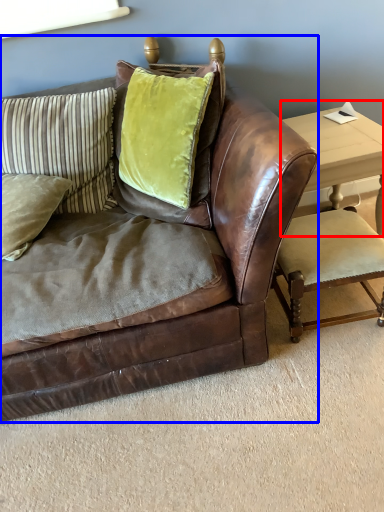
Question: Which object appears farthest to the camera in this image, table (highlighted by a red box) or studio couch (highlighted by a blue box)?

Choices:
 (A) table
 (B) studio couch

Answer: (A)